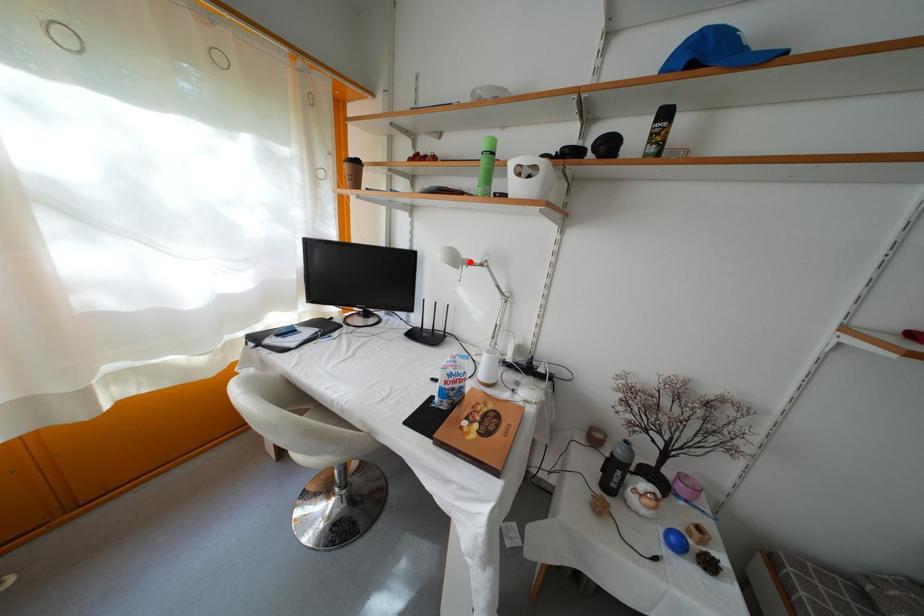
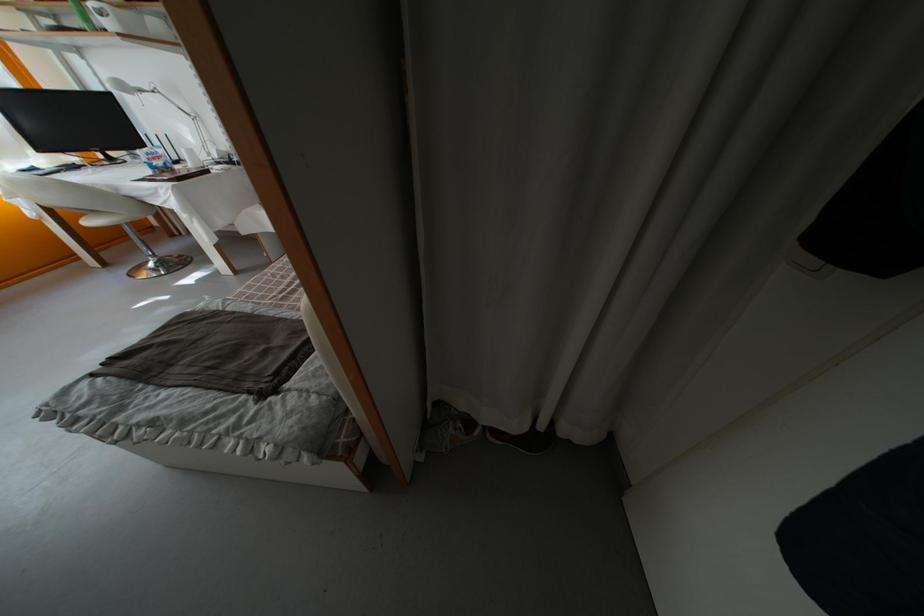
Question: I am providing you with two images of the same scene from different viewpoints. Image1 has a red point marked. In image2, the corresponding 3D location appears at what relative position? Reply with the corresponding letter.

Choices:
 (A) Closer
 (B) Farther

Answer: (B)